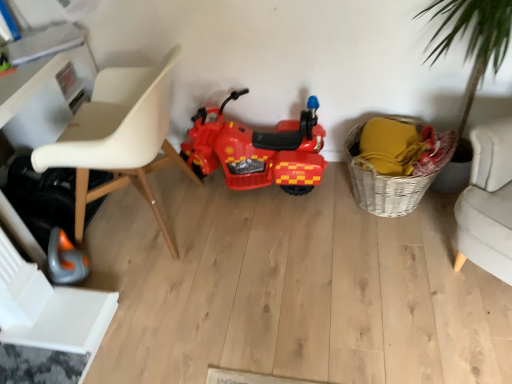
Find the location of `empty space that is to the right of white plastic chair at left`. empty space that is to the right of white plastic chair at left is located at coordinates (273, 238).